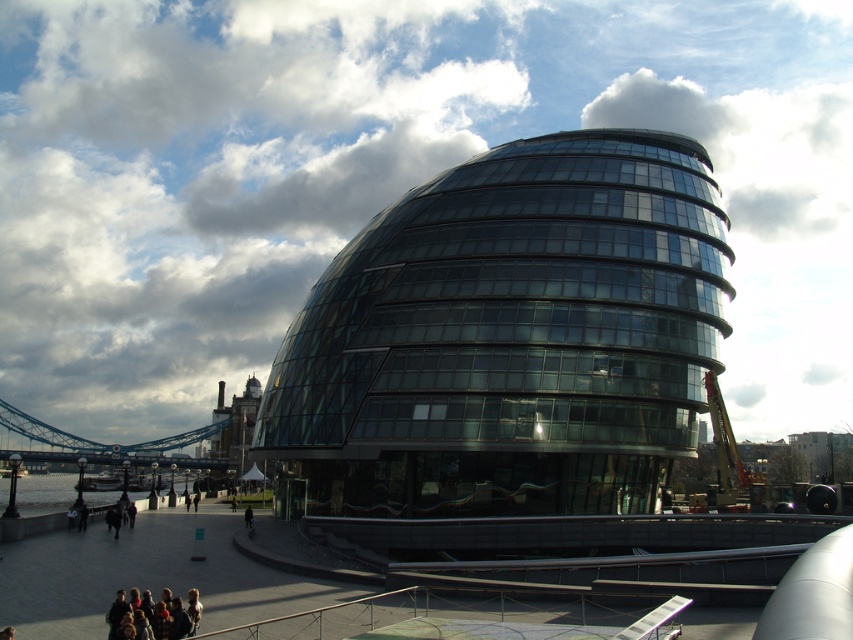
Question: Among these objects, which one is farthest from the camera?

Choices:
 (A) metallic gray suspension bridge at lower left
 (B) blurred skin people at lower left
 (C) transparent glass dome at center

Answer: (A)

Question: Does metallic construction crane at right come behind dark gray jacket at lower center?

Choices:
 (A) no
 (B) yes

Answer: (B)

Question: Can you confirm if transparent glass dome at center is wider than metallic gray suspension bridge at lower left?

Choices:
 (A) yes
 (B) no

Answer: (A)

Question: Which point appears farthest from the camera in this image?

Choices:
 (A) (251, 522)
 (B) (55, 429)

Answer: (B)

Question: Among these points, which one is farthest from the camera?

Choices:
 (A) (252, 513)
 (B) (726, 481)
 (C) (94, 442)
 (D) (671, 157)

Answer: (C)

Question: Is transparent glass dome at center behind dark gray jacket at lower center?

Choices:
 (A) no
 (B) yes

Answer: (A)